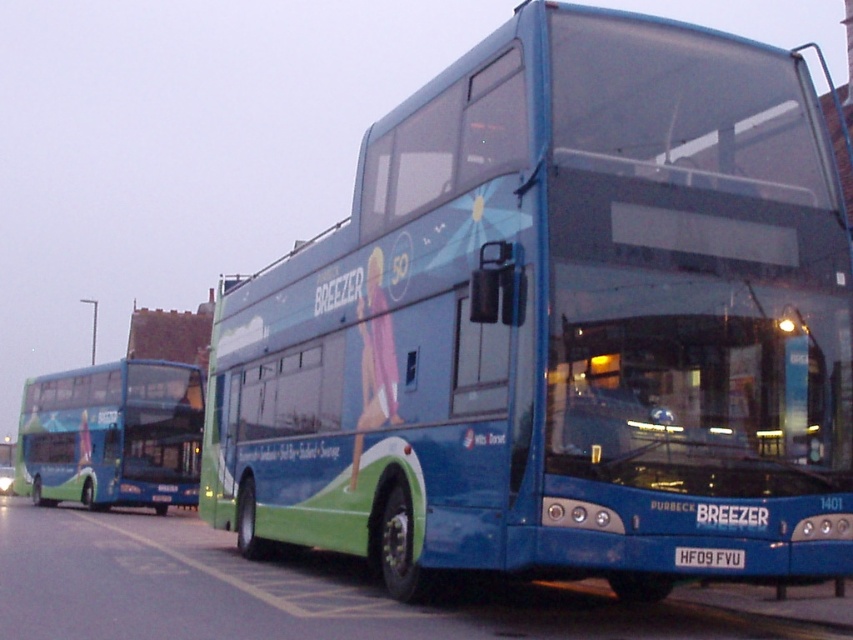
Question: Which object is positioned farthest from the white plastic license plate at center?

Choices:
 (A) blue glossy bus at left
 (B) blue metallic bus at center

Answer: (A)

Question: Which object is closer to the camera taking this photo?

Choices:
 (A) blue glossy bus at left
 (B) blue metallic bus at center
 (C) white plastic license plate at center

Answer: (B)

Question: Does blue glossy bus at left have a smaller size compared to white plastic license plate at center?

Choices:
 (A) no
 (B) yes

Answer: (A)

Question: Does blue glossy bus at left lie in front of white plastic license plate at center?

Choices:
 (A) yes
 (B) no

Answer: (B)

Question: Which point is closer to the camera?

Choices:
 (A) click(x=84, y=497)
 (B) click(x=743, y=552)

Answer: (B)

Question: Is blue metallic bus at center smaller than blue glossy bus at left?

Choices:
 (A) no
 (B) yes

Answer: (B)